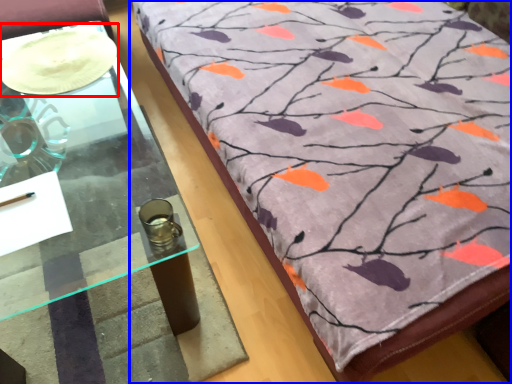
Question: Which object is further to the camera taking this photo, glass plate (highlighted by a red box) or furniture (highlighted by a blue box)?

Choices:
 (A) glass plate
 (B) furniture

Answer: (A)